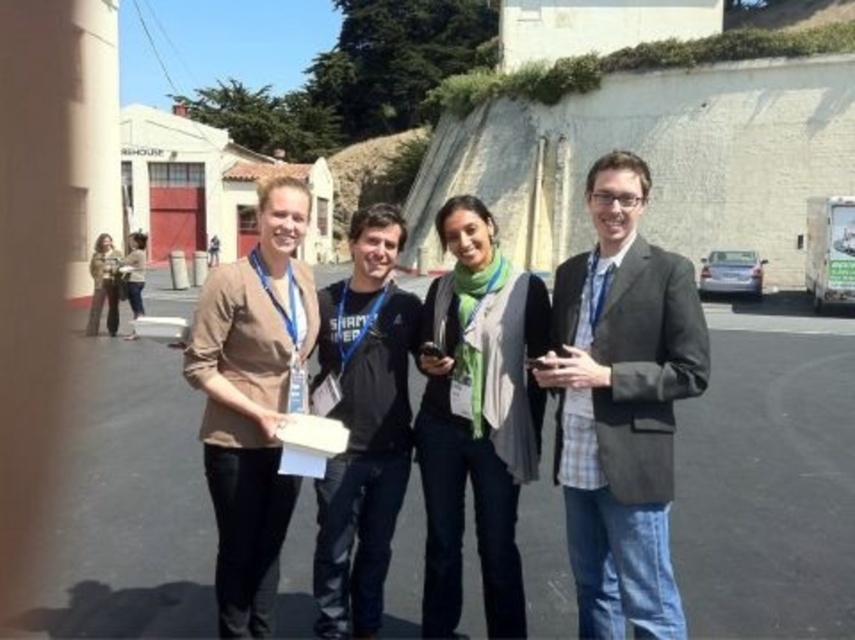
You are a photographer trying to frame a group photo of the matte gray blazer at center and the beige fabric shirt at center. Which clothing item should you adjust to ensure both fit within the camera frame without cropping?

The matte gray blazer at center has a lesser width compared to the beige fabric shirt at center. To ensure both fit within the camera frame without cropping, you should adjust the beige fabric shirt at center since it is wider and may require more space.

You are a photographer trying to capture a group photo of the matte gray blazer at center and the beige fabric shirt at center. Your camera has a maximum focus range of 50 feet. Will you be able to focus on both subjects simultaneously?

The distance between the matte gray blazer at center and the beige fabric shirt at center is 51.65 feet. Since the camera can only focus up to 50 feet, it won